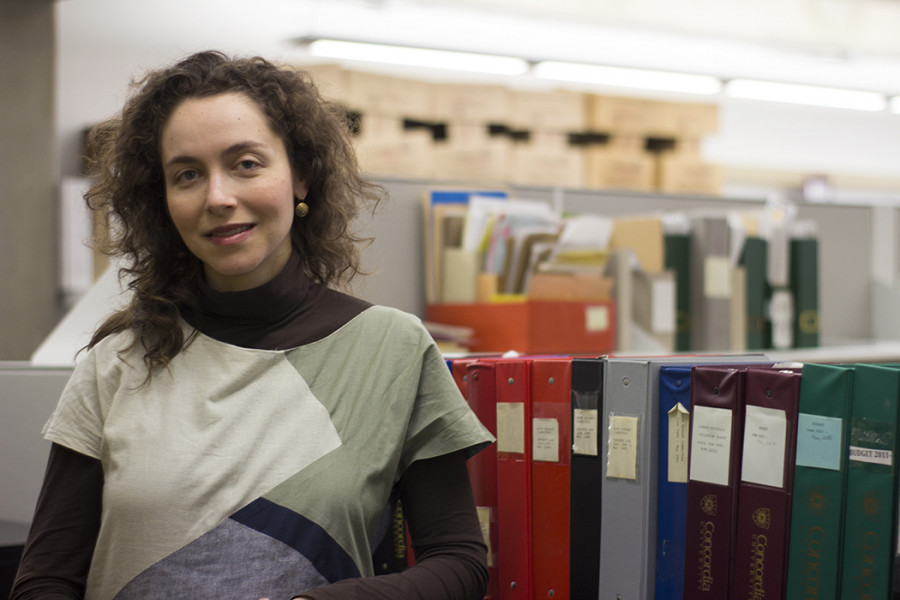
Find the location of a particular element. shelf is located at coordinates (384, 239).